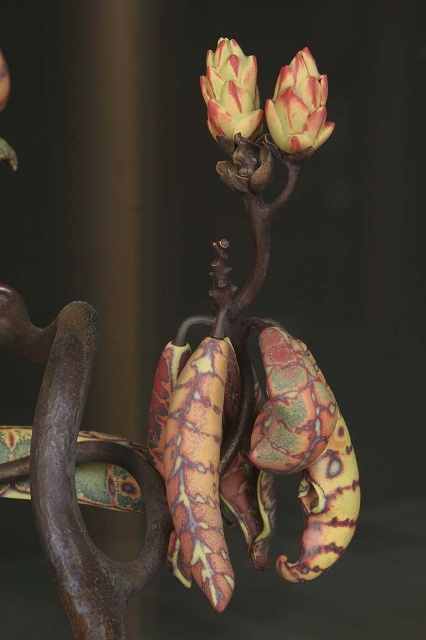
Question: Which point is closer to the camera?

Choices:
 (A) matte pinkish-green flower at upper center
 (B) matte pinkish-red flower at upper center

Answer: (B)

Question: Is matte pinkish-red flower at upper center behind matte pinkish-green flower at upper center?

Choices:
 (A) no
 (B) yes

Answer: (A)

Question: Does matte pinkish-red flower at upper center have a smaller size compared to matte pinkish-green flower at upper center?

Choices:
 (A) yes
 (B) no

Answer: (A)

Question: Which object is farther from the camera taking this photo?

Choices:
 (A) matte pinkish-red flower at upper center
 (B) matte pinkish-green flower at upper center

Answer: (B)

Question: Is the position of matte pinkish-red flower at upper center more distant than that of matte pinkish-green flower at upper center?

Choices:
 (A) yes
 (B) no

Answer: (B)